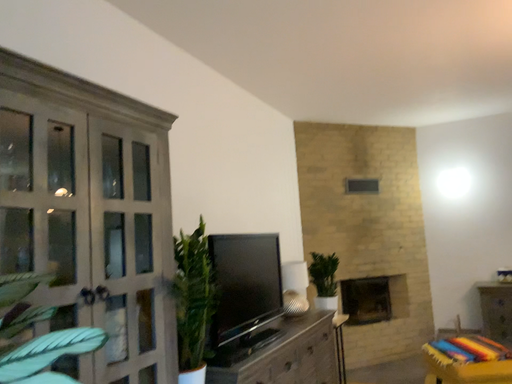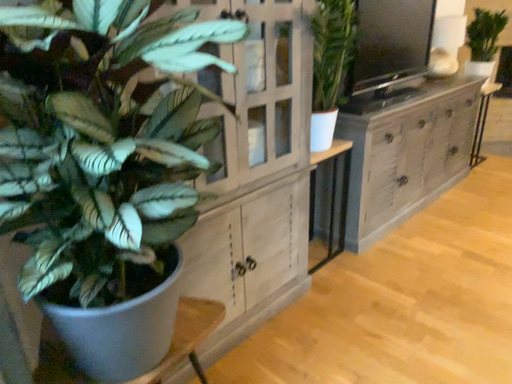
Question: How did the camera likely rotate when shooting the video?

Choices:
 (A) rotated upward
 (B) rotated downward

Answer: (B)